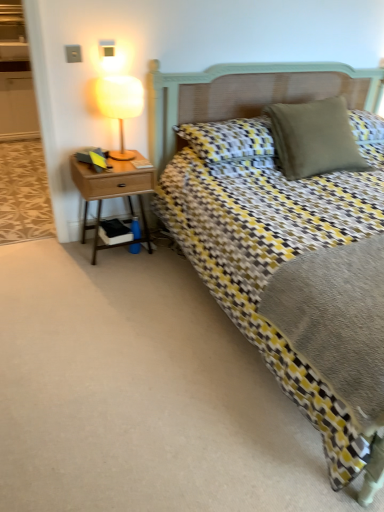
Identify the location of vacant space situated on the left part of woodennightstand at left. This screenshot has width=384, height=512. (66, 253).